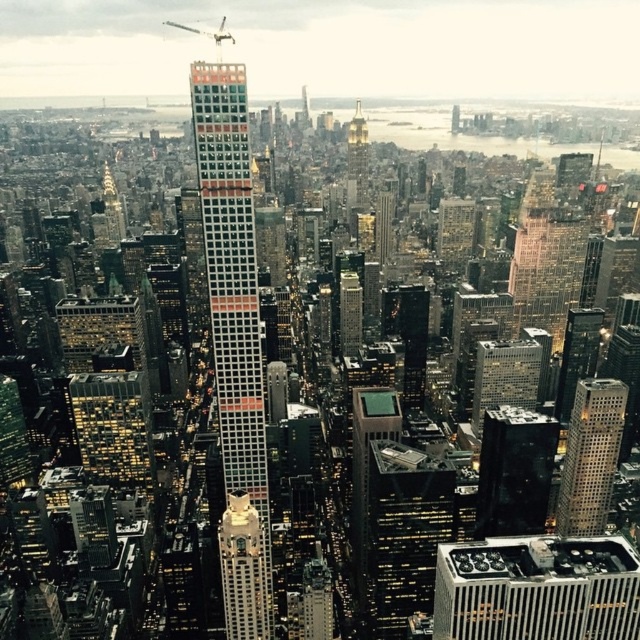
You are a drone operator tasked with delivering a package to the tallest building in the city. Your GPS shows a point at coordinates (232,289). Based on the cityscape, can you confirm if this point is located on the tallest building?

The point (232,289) is on the white glass skyscraper at center, which is the tallest building in the city. Therefore, the point is indeed located on the tallest building.

You are a drone operator trying to deliver a package to a specific location on the white glass skyscraper at center. The delivery system requires you to input the exact coordinates of the target area. What are the coordinates you should enter?

The coordinates for the white glass skyscraper at center are point (232, 289).

You are standing at the center of the city and want to locate the glassy reflective skyscraper at center. What are the coordinates of this skyscraper?

The glassy reflective skyscraper at center is located at coordinates point (404, 532).